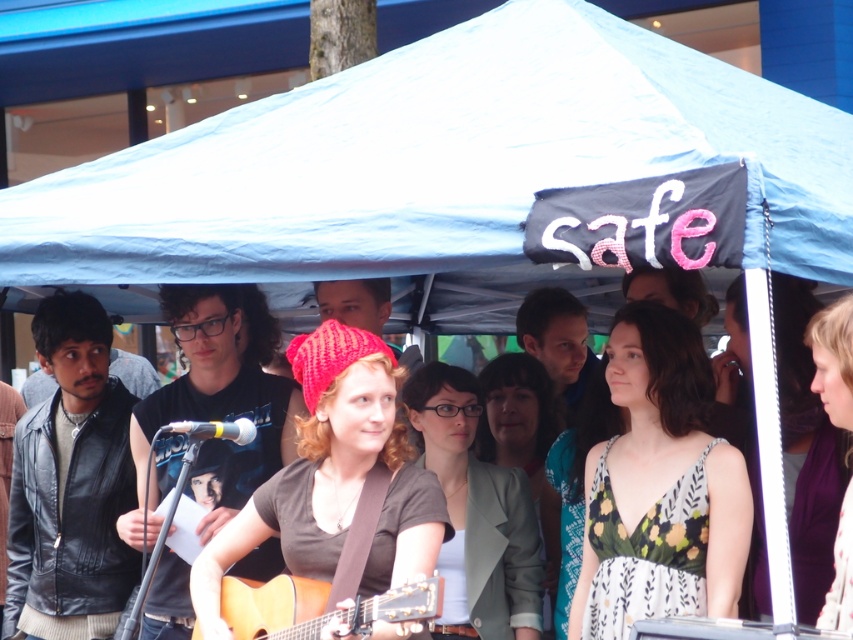
Based on the photo, you are standing at the entrance of the tent and want to move towards the point labeled as point (x=413, y=422). There is an obstacle at point (x=380, y=317). Will you encounter the obstacle before reaching your destination?

Point (x=413, y=422) is in front of point (x=380, y=317), so you will reach your destination before encountering the obstacle.